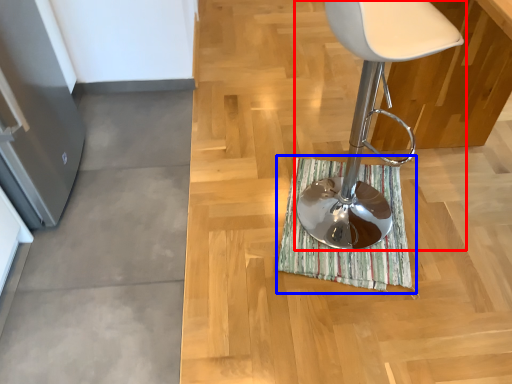
Question: Which point is closer to the camera, chair (highlighted by a red box) or bath mat (highlighted by a blue box)?

Choices:
 (A) chair
 (B) bath mat

Answer: (A)